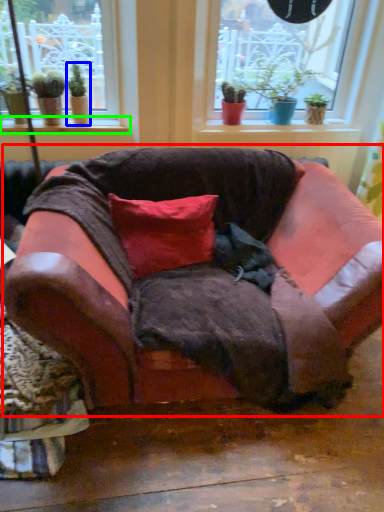
Question: Considering the real-world distances, which object is farthest from studio couch (highlighted by a red box)? houseplant (highlighted by a blue box) or window sill (highlighted by a green box)?

Choices:
 (A) houseplant
 (B) window sill

Answer: (A)